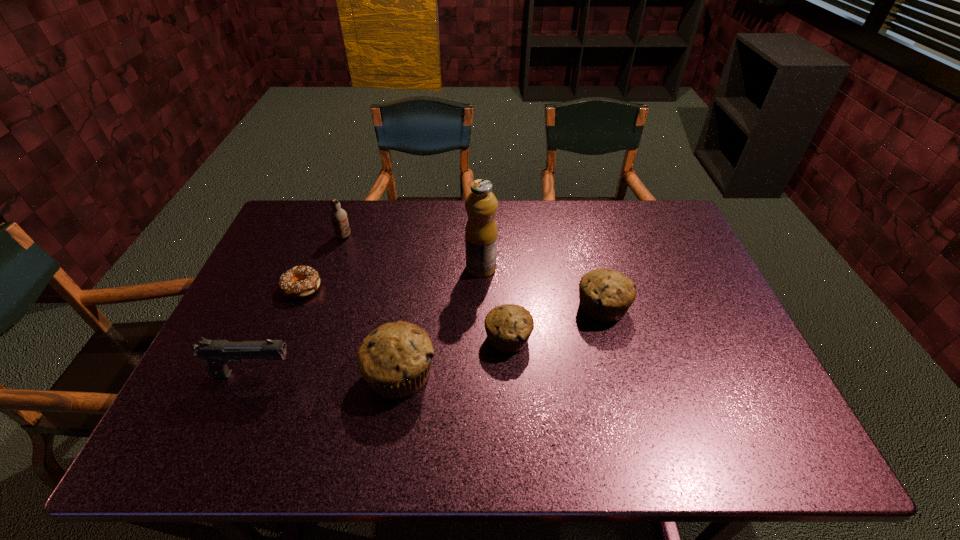
Find the location of a particular element. The image size is (960, 540). the fourth object from right to left is located at coordinates (395, 359).

Where is `the second muffin from right to left`? The width and height of the screenshot is (960, 540). the second muffin from right to left is located at coordinates (508, 327).

At what (x,y) coordinates should I click in order to perform the action: click on the second shortest object. Please return your answer as a coordinate pair (x, y). The image size is (960, 540). Looking at the image, I should click on (508, 327).

Locate an element on the screen. Image resolution: width=960 pixels, height=540 pixels. the second tallest muffin is located at coordinates (605, 295).

The width and height of the screenshot is (960, 540). What are the coordinates of `the rightmost object` in the screenshot? It's located at click(x=605, y=295).

Locate an element on the screen. fruit juice is located at coordinates (481, 233).

Locate an element on the screen. chocolate milk is located at coordinates (338, 216).

This screenshot has width=960, height=540. Find the location of `gun`. gun is located at coordinates (217, 353).

You are a GUI agent. You are given a task and a screenshot of the screen. Output one action in this format:
    pyautogui.click(x=<x>, y=<y>)
    Task: Click on the shortest object
    The image size is (960, 540).
    Given the screenshot: What is the action you would take?
    pyautogui.click(x=310, y=280)

The height and width of the screenshot is (540, 960). I want to click on free location located 0.350m on the back of the leftmost muffin, so click(419, 254).